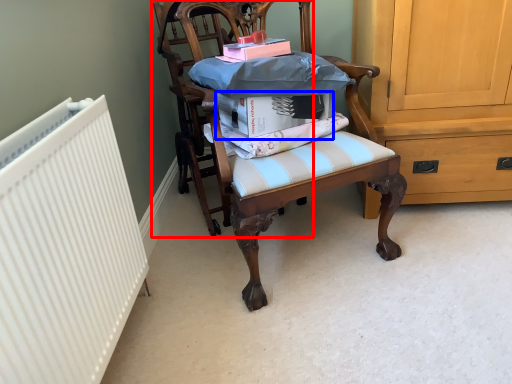
Question: Among these objects, which one is farthest to the camera, chair (highlighted by a red box) or book (highlighted by a blue box)?

Choices:
 (A) chair
 (B) book

Answer: (A)